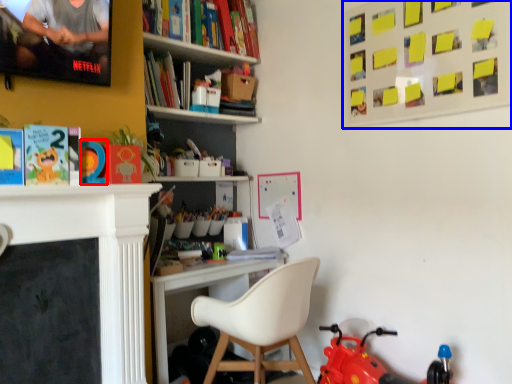
Question: Which point is closer to the camera, toy (highlighted by a red box) or bulletin board (highlighted by a blue box)?

Choices:
 (A) toy
 (B) bulletin board

Answer: (B)